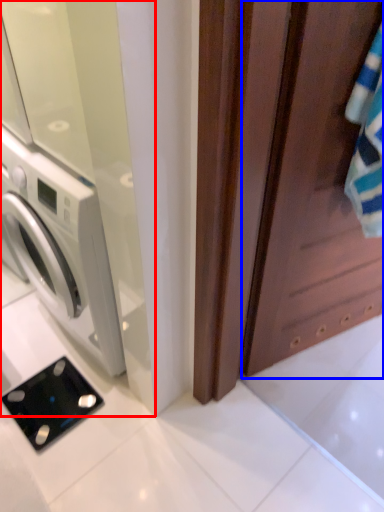
Question: Which of the following is the farthest to the observer, screen door (highlighted by a red box) or screen door (highlighted by a blue box)?

Choices:
 (A) screen door
 (B) screen door

Answer: (A)